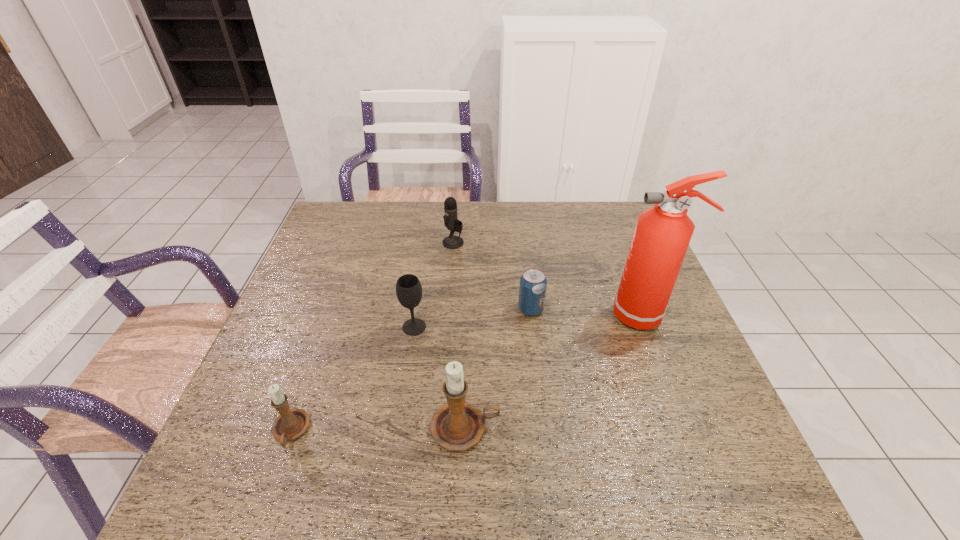
Identify the location of the left candle holder. (291, 423).

Where is `the leftmost object`? The height and width of the screenshot is (540, 960). the leftmost object is located at coordinates (291, 423).

This screenshot has height=540, width=960. Find the location of `the right candle holder`. the right candle holder is located at coordinates (456, 426).

Find the location of a particular element. This screenshot has height=540, width=960. the second tallest object is located at coordinates (456, 426).

The width and height of the screenshot is (960, 540). I want to click on microphone, so [x=451, y=222].

Where is `wineglass`? The height and width of the screenshot is (540, 960). wineglass is located at coordinates (408, 287).

Locate an element on the screen. This screenshot has height=540, width=960. pop soda is located at coordinates (533, 283).

This screenshot has height=540, width=960. What are the coordinates of `the shortest object` in the screenshot? It's located at (533, 283).

At what (x,y) coordinates should I click in order to perform the action: click on fire extinguisher. Please return your answer as a coordinate pair (x, y). Looking at the image, I should click on (662, 235).

At what (x,y) coordinates should I click in order to perform the action: click on the rightmost object. Please return your answer as a coordinate pair (x, y). This screenshot has width=960, height=540. Looking at the image, I should click on (662, 235).